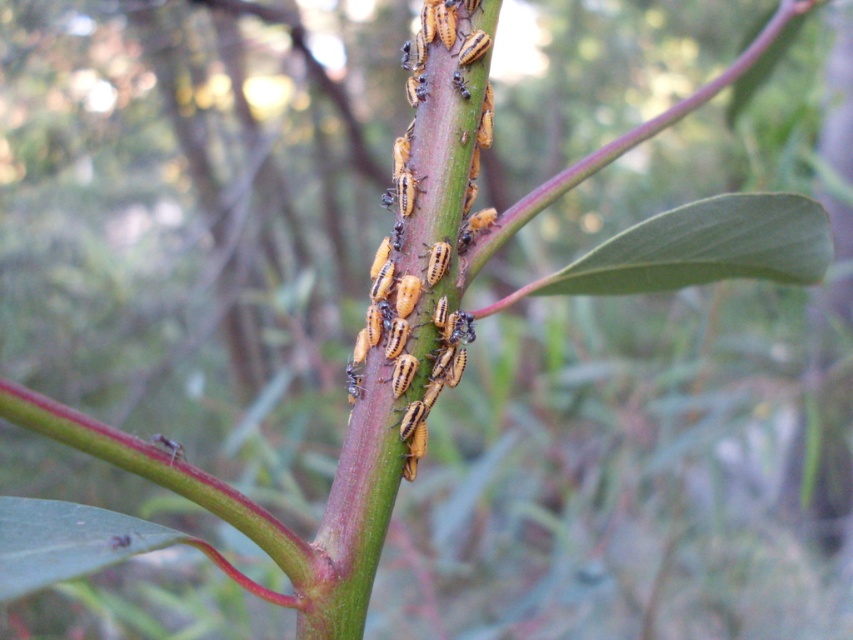
Question: Which of the following is the farthest from the observer?

Choices:
 (A) green smooth leaf at center
 (B) yellow matte insects at center

Answer: (A)

Question: Can you confirm if yellow matte insects at center is positioned above green smooth leaf at center?

Choices:
 (A) no
 (B) yes

Answer: (B)

Question: Can you confirm if yellow matte insects at center is positioned to the right of green smooth leaf at center?

Choices:
 (A) yes
 (B) no

Answer: (B)

Question: Is yellow matte insects at center above green smooth leaf at center?

Choices:
 (A) yes
 (B) no

Answer: (A)

Question: Among these objects, which one is nearest to the camera?

Choices:
 (A) yellow matte insects at center
 (B) green smooth leaf at center

Answer: (A)